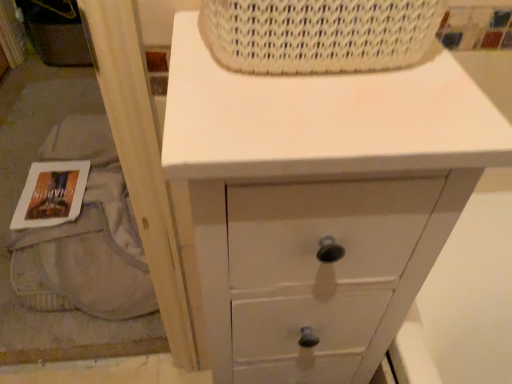
Question: Would you say white painted wood chest of drawers at upper center is part of white paper book at lower left's contents?

Choices:
 (A) yes
 (B) no

Answer: (B)

Question: Considering the relative positions of white paper book at lower left and white painted wood chest of drawers at upper center in the image provided, is white paper book at lower left to the right of white painted wood chest of drawers at upper center from the viewer's perspective?

Choices:
 (A) yes
 (B) no

Answer: (B)

Question: Could you tell me if white paper book at lower left is facing white painted wood chest of drawers at upper center?

Choices:
 (A) no
 (B) yes

Answer: (A)

Question: From a real-world perspective, is white paper book at lower left physically below white painted wood chest of drawers at upper center?

Choices:
 (A) yes
 (B) no

Answer: (A)

Question: From the image's perspective, is white paper book at lower left above white painted wood chest of drawers at upper center?

Choices:
 (A) yes
 (B) no

Answer: (A)

Question: Based on their sizes in the image, would you say white paper book at lower left is bigger or smaller than white painted wood chest of drawers at upper center?

Choices:
 (A) big
 (B) small

Answer: (B)

Question: Is point click(51, 208) closer or farther from the camera than point click(464, 198)?

Choices:
 (A) closer
 (B) farther

Answer: (B)

Question: Based on their positions, is white paper book at lower left located to the left or right of white painted wood chest of drawers at upper center?

Choices:
 (A) right
 (B) left

Answer: (B)

Question: Looking at their shapes, would you say white paper book at lower left is wider or thinner than white painted wood chest of drawers at upper center?

Choices:
 (A) thin
 (B) wide

Answer: (A)

Question: Would you say white paper book at lower left is to the left or to the right of white woven basket at upper center in the picture?

Choices:
 (A) right
 (B) left

Answer: (B)

Question: From the image's perspective, is white paper book at lower left located above or below white woven basket at upper center?

Choices:
 (A) below
 (B) above

Answer: (A)

Question: Looking at their shapes, would you say white paper book at lower left is wider or thinner than white woven basket at upper center?

Choices:
 (A) thin
 (B) wide

Answer: (B)

Question: From their relative heights in the image, would you say white paper book at lower left is taller or shorter than white woven basket at upper center?

Choices:
 (A) short
 (B) tall

Answer: (A)

Question: Considering their positions, is white painted wood chest of drawers at upper center located in front of or behind white paper book at lower left?

Choices:
 (A) behind
 (B) front

Answer: (B)

Question: Is point (409, 117) closer or farther from the camera than point (80, 201)?

Choices:
 (A) farther
 (B) closer

Answer: (B)